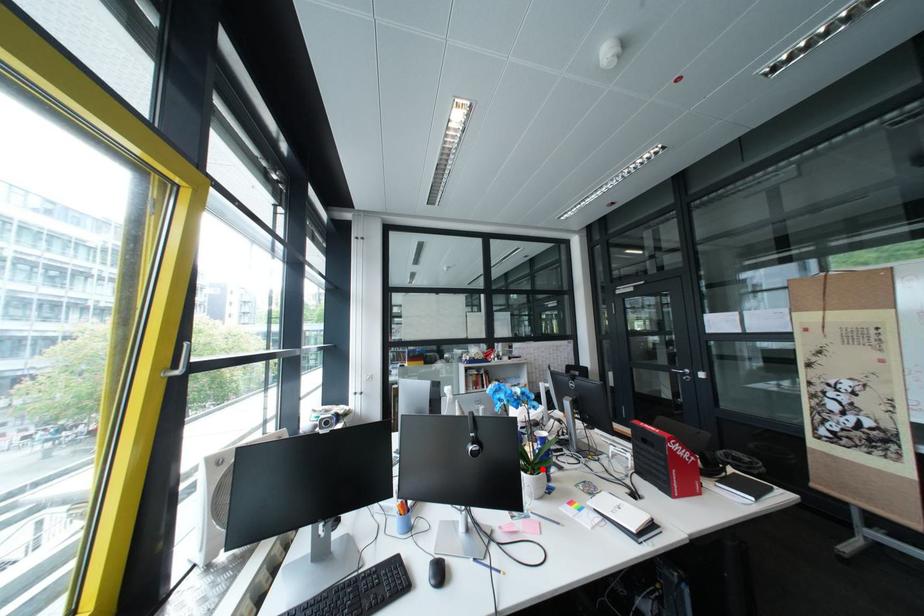
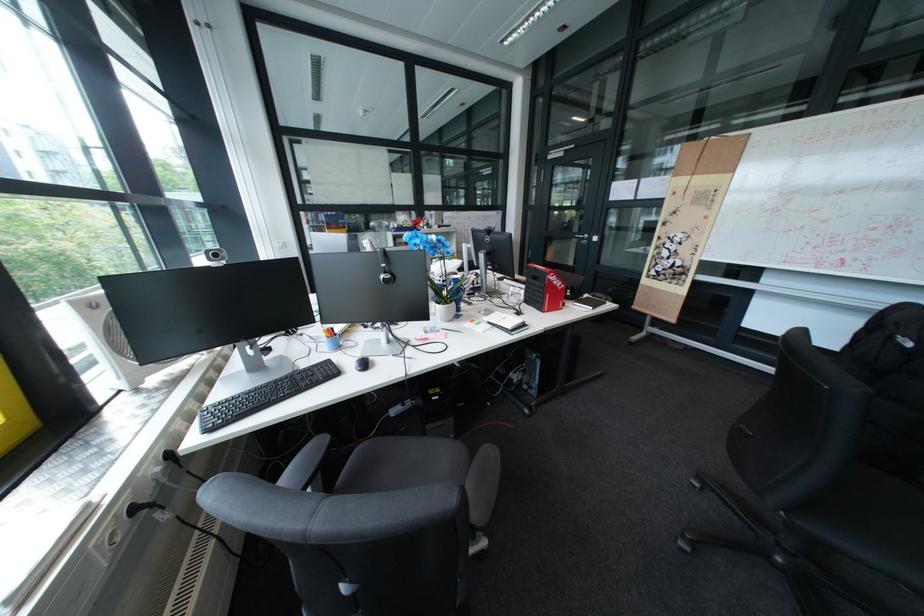
The point at the highlighted location is marked in the first image. Where is the corresponding point in the second image?

(456, 302)